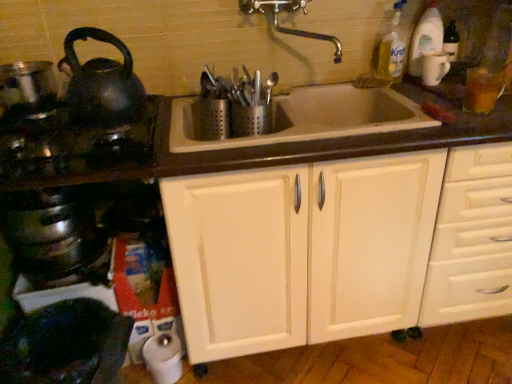
Find the location of a particular element. This screenshot has height=384, width=512. blank area beneath shiny metallic pot at left (from a real-world perspective) is located at coordinates (25, 108).